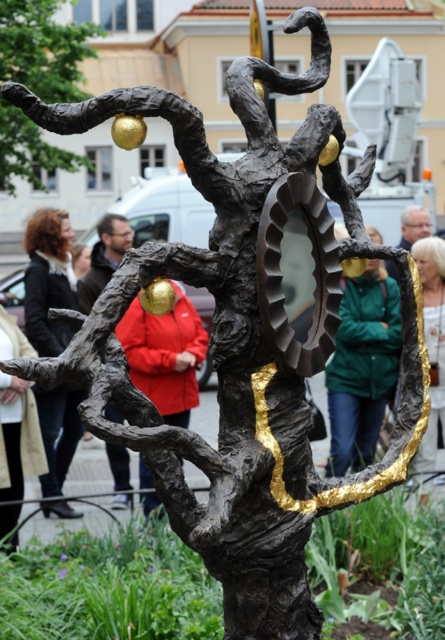
Does green matte jacket at center have a larger size compared to gold metallic sphere at upper center?

Indeed, green matte jacket at center has a larger size compared to gold metallic sphere at upper center.

Based on the photo, who is taller, green matte jacket at center or gold metallic sphere at upper center?

green matte jacket at center is taller.

Is point (336, 353) in front of point (136, 124)?

No, (336, 353) is behind (136, 124).

The height and width of the screenshot is (640, 445). I want to click on green matte jacket at center, so click(361, 365).

Who is more forward, (28, 13) or (164, 284)?

Positioned in front is point (164, 284).

Is point (72, 52) positioned after point (153, 308)?

Yes.

Describe the element at coordinates (43, 49) in the screenshot. The width and height of the screenshot is (445, 640). I see `bronze textured tree at upper left` at that location.

This screenshot has height=640, width=445. I want to click on bronze textured tree at upper left, so click(x=43, y=49).

Measure the distance between black leather jacket at left and golden metallic hair at upper right.

The distance of black leather jacket at left from golden metallic hair at upper right is 5.93 feet.

Can you confirm if black leather jacket at left is wider than golden metallic hair at upper right?

Yes, black leather jacket at left is wider than golden metallic hair at upper right.

Image resolution: width=445 pixels, height=640 pixels. I want to click on black leather jacket at left, so click(48, 280).

Find the location of `black leather jacket at left`. black leather jacket at left is located at coordinates (48, 280).